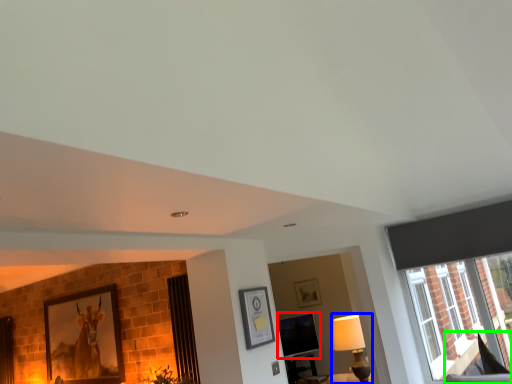
Question: Which is nearer to the window screen (highlighted by a red box)? lamp (highlighted by a blue box) or swivel chair (highlighted by a green box).

Choices:
 (A) lamp
 (B) swivel chair

Answer: (A)